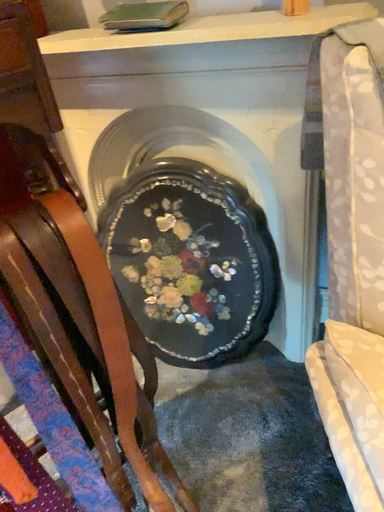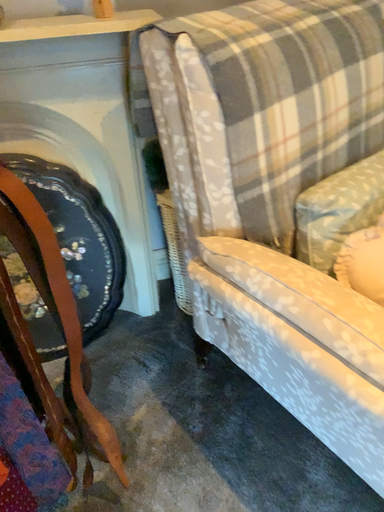
Question: Which way did the camera rotate in the video?

Choices:
 (A) rotated upward
 (B) rotated downward

Answer: (A)